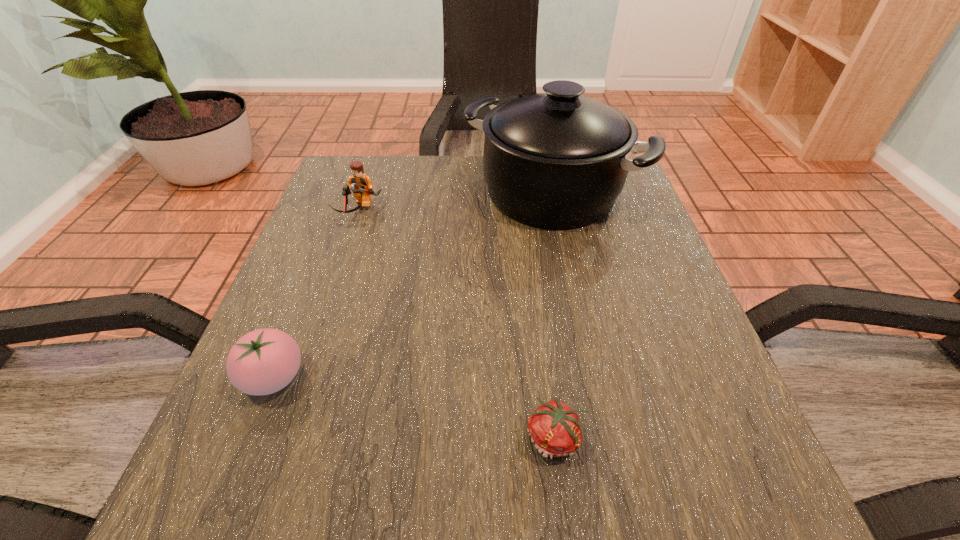
Find the location of `free region at the left edge of the desktop`. free region at the left edge of the desktop is located at coordinates (333, 246).

The height and width of the screenshot is (540, 960). I want to click on vacant area at the right edge of the desktop, so click(x=627, y=394).

This screenshot has width=960, height=540. In the image, there is a desktop. What are the coordinates of `vacant space at the far left corner` in the screenshot? It's located at (345, 175).

Where is `vacant space at the near left corner of the desktop`? This screenshot has height=540, width=960. vacant space at the near left corner of the desktop is located at coordinates (226, 483).

At what (x,y) coordinates should I click in order to perform the action: click on free region at the near right corner. Please return your answer as a coordinate pair (x, y). Looking at the image, I should click on (658, 492).

Identify the location of vacant space that's between the Lego and the tallest object. The height and width of the screenshot is (540, 960). (454, 202).

I want to click on free space between the saucepan and the nearer tomato, so click(553, 315).

The image size is (960, 540). What are the coordinates of `vacant area that lies between the tallest object and the nearer tomato` in the screenshot? It's located at (553, 315).

This screenshot has width=960, height=540. I want to click on empty space that is in between the nearest object and the third shortest object, so click(457, 325).

Locate an element on the screen. blank region between the shorter tomato and the saucepan is located at coordinates (553, 315).